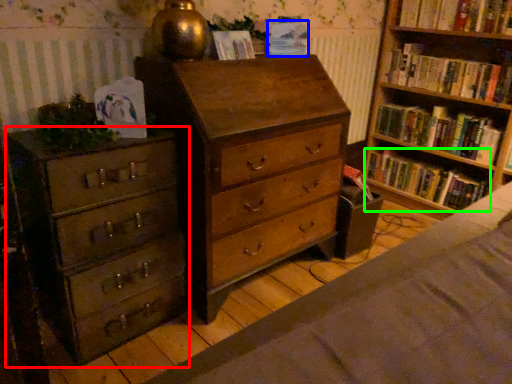
Question: Which is farther away from chest of drawers (highlighted by a red box)? paperback book (highlighted by a blue box) or book (highlighted by a green box)?

Choices:
 (A) paperback book
 (B) book

Answer: (B)